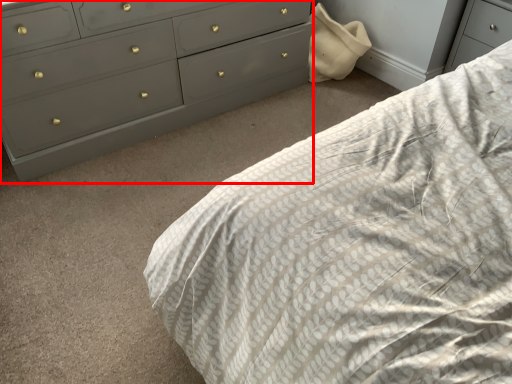
Question: From the image's perspective, where is chest of drawers (annotated by the red box) located in relation to bed in the image?

Choices:
 (A) above
 (B) below

Answer: (A)